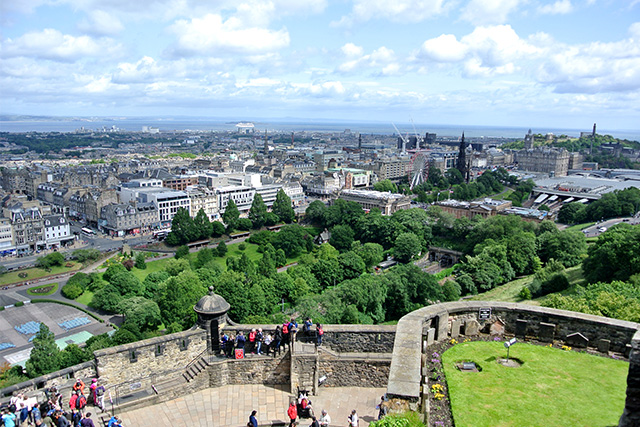
The height and width of the screenshot is (427, 640). In order to click on window in this screenshot , I will do `click(52, 233)`, `click(59, 226)`, `click(164, 201)`, `click(235, 195)`, `click(6, 236)`, `click(22, 240)`.